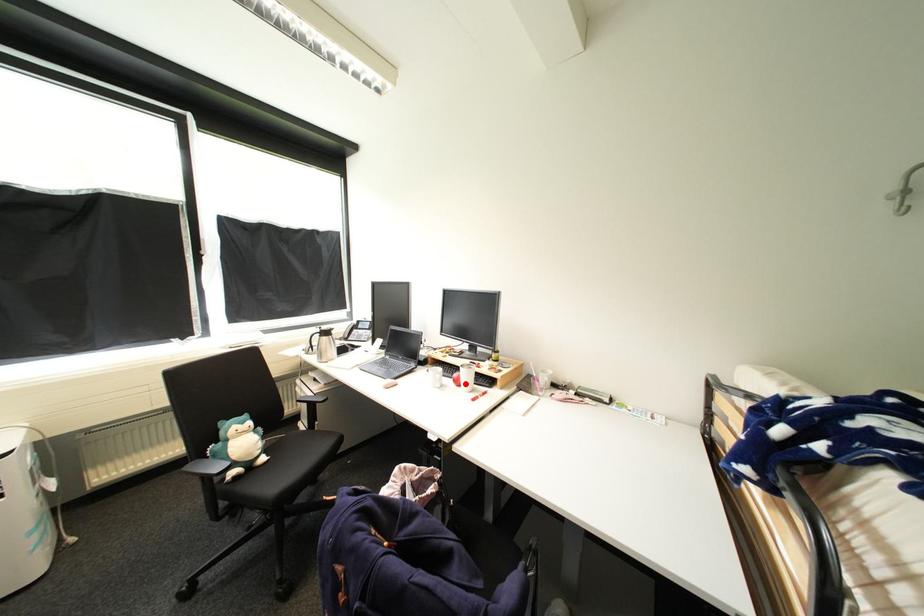
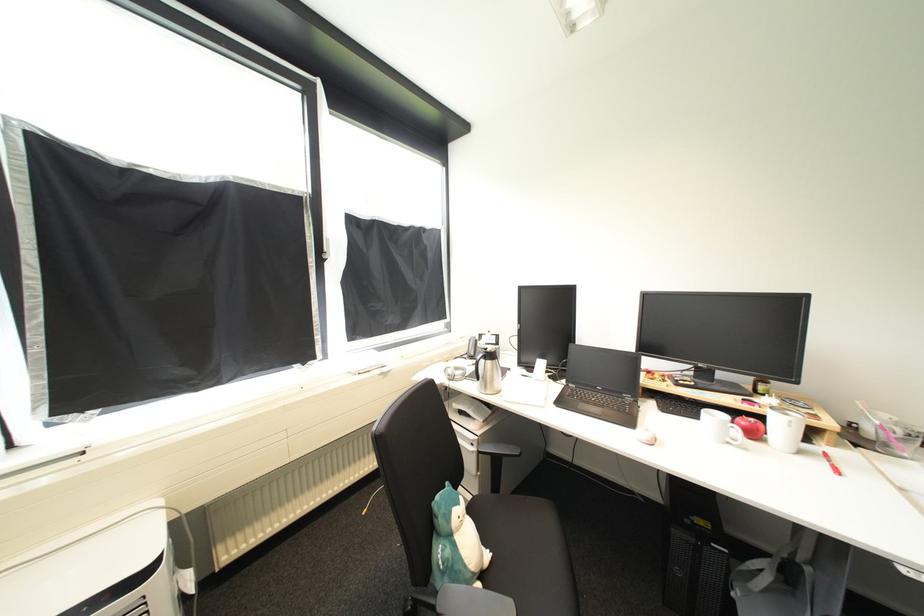
Question: I am providing you with two images of the same scene from different viewpoints. A red point is marked on the first image. Can you still see the location of the red point in image 2?

Choices:
 (A) Yes
 (B) No

Answer: (A)